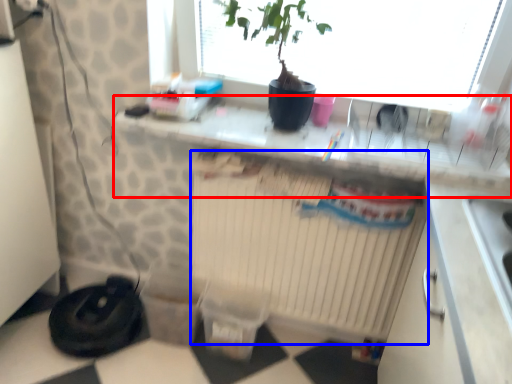
Question: Among these objects, which one is nearest to the camera, counter top (highlighted by a red box) or radiator (highlighted by a blue box)?

Choices:
 (A) counter top
 (B) radiator

Answer: (A)